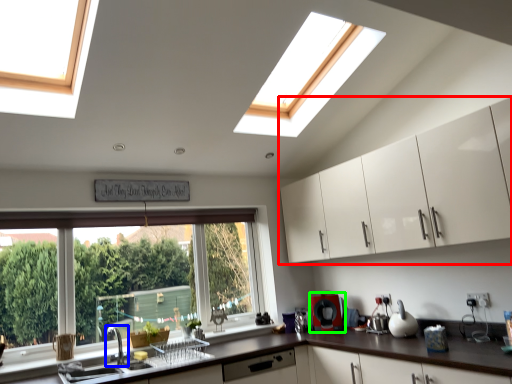
Question: Based on their relative distances, which object is farther from cabinetry (highlighted by a red box)? Choose from tap (highlighted by a blue box) and appliance (highlighted by a green box).

Choices:
 (A) tap
 (B) appliance

Answer: (A)